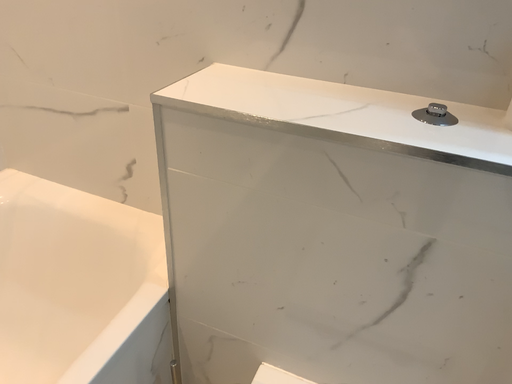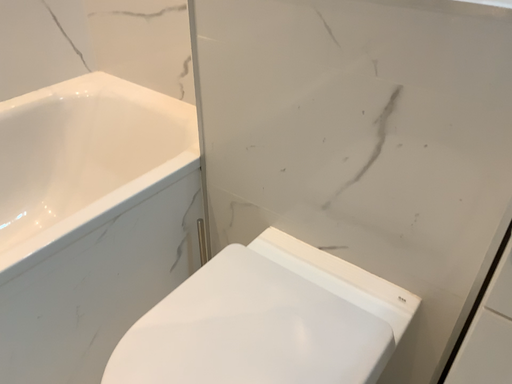
Question: How did the camera likely rotate when shooting the video?

Choices:
 (A) rotated left
 (B) rotated right

Answer: (A)